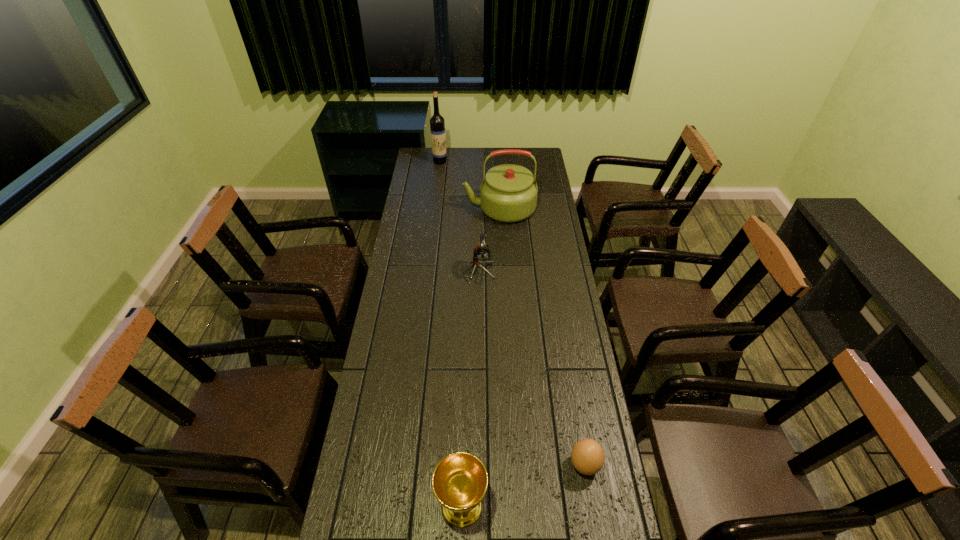
Identify the location of unoccupied position between the earphone and the wine bottle. This screenshot has width=960, height=540. (460, 217).

What are the coordinates of `object that is the third closest to the shortest object` in the screenshot? It's located at (508, 193).

Identify which object is the second nearest to the farthest object. Please provide its 2D coordinates. Your answer should be formatted as a tuple, i.e. [(x, y)], where the tuple contains the x and y coordinates of a point satisfying the conditions above.

[(481, 254)]

Where is `vacant position in the image that satisfies the following two spatial constraints: 1. on the label of the chalice; 2. on the left side of the tallest object`? Image resolution: width=960 pixels, height=540 pixels. vacant position in the image that satisfies the following two spatial constraints: 1. on the label of the chalice; 2. on the left side of the tallest object is located at coordinates (397, 505).